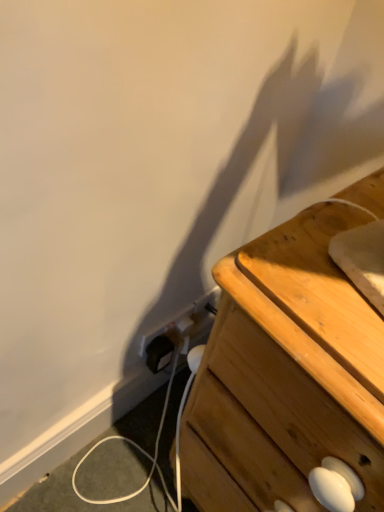
Question: Is point (294, 324) positioned closer to the camera than point (180, 343)?

Choices:
 (A) closer
 (B) farther

Answer: (A)

Question: Looking at the image, does wooden chest of drawers at right seem bigger or smaller compared to white plastic electric outlet at lower center?

Choices:
 (A) small
 (B) big

Answer: (B)

Question: From the image's perspective, is wooden chest of drawers at right positioned above or below white plastic electric outlet at lower center?

Choices:
 (A) below
 (B) above

Answer: (A)

Question: Is point (163, 364) positioned closer to the camera than point (345, 440)?

Choices:
 (A) closer
 (B) farther

Answer: (B)

Question: Would you say white plastic electric outlet at lower center is to the left or to the right of wooden chest of drawers at right in the picture?

Choices:
 (A) right
 (B) left

Answer: (B)

Question: From their relative heights in the image, would you say white plastic electric outlet at lower center is taller or shorter than wooden chest of drawers at right?

Choices:
 (A) short
 (B) tall

Answer: (A)

Question: From the image's perspective, is white plastic electric outlet at lower center located above or below wooden chest of drawers at right?

Choices:
 (A) above
 (B) below

Answer: (A)